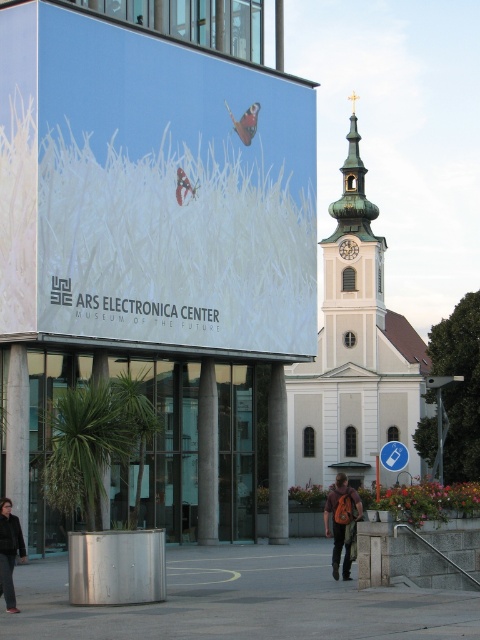
Question: Is brushed metal pavement at lower center positioned at the back of gray concrete pillar at center?

Choices:
 (A) yes
 (B) no

Answer: (B)

Question: Is brushed metal pavement at lower center smaller than gray concrete pillar at center?

Choices:
 (A) no
 (B) yes

Answer: (A)

Question: Which point is farther from the camera taking this photo?

Choices:
 (A) [348, 509]
 (B) [202, 477]
 (C) [135, 608]

Answer: (B)

Question: Which point is farther from the camera taking this photo?

Choices:
 (A) (96, 198)
 (B) (276, 493)
 (C) (295, 596)

Answer: (B)

Question: Can you confirm if orange backpack at center is wider than dark gray jacket at lower left?

Choices:
 (A) yes
 (B) no

Answer: (A)

Question: Based on their relative distances, which object is nearer to the dark gray jacket at lower left?

Choices:
 (A) white concrete pillar at center
 (B) gray concrete pillar at center

Answer: (B)